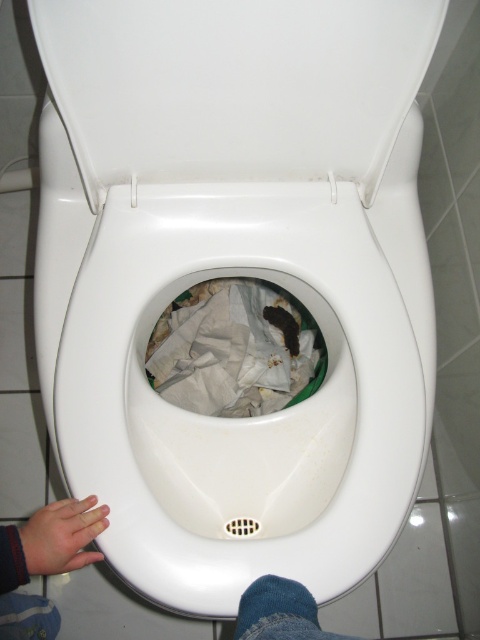
Question: Which of these objects is positioned farthest from the skinny hand at lower left?

Choices:
 (A) white glossy toilet lid at upper center
 (B) white crumpled paper at center

Answer: (A)

Question: Estimate the real-world distances between objects in this image. Which object is closer to the white crumpled paper at center?

Choices:
 (A) white glossy toilet lid at upper center
 (B) skinny hand at lower left

Answer: (A)

Question: In this image, where is white glossy toilet lid at upper center located relative to skinny hand at lower left?

Choices:
 (A) left
 (B) right

Answer: (B)

Question: Which object appears farthest from the camera in this image?

Choices:
 (A) white crumpled paper at center
 (B) white glossy toilet lid at upper center

Answer: (A)

Question: Is white glossy toilet lid at upper center smaller than white crumpled paper at center?

Choices:
 (A) yes
 (B) no

Answer: (B)

Question: From the image, what is the correct spatial relationship of white glossy toilet lid at upper center in relation to white crumpled paper at center?

Choices:
 (A) left
 (B) right

Answer: (B)